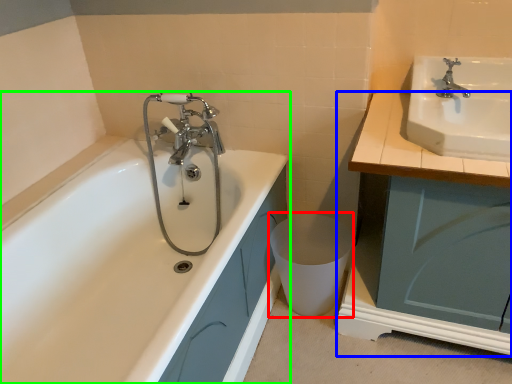
Question: Estimate the real-world distances between objects in this image. Which object is closer to toilet bowl (highlighted by a red box), cabinetry (highlighted by a blue box) or bathtub (highlighted by a green box)?

Choices:
 (A) cabinetry
 (B) bathtub

Answer: (B)